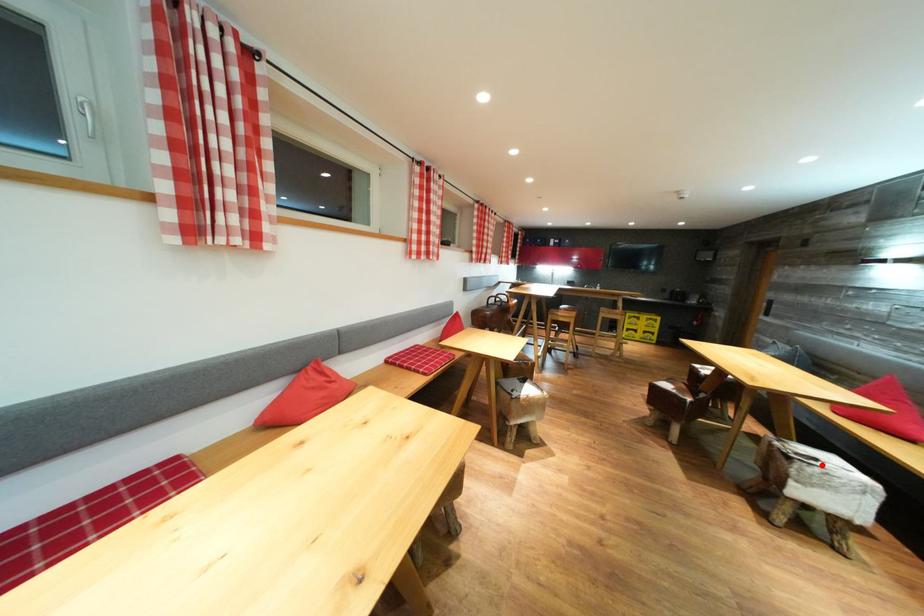
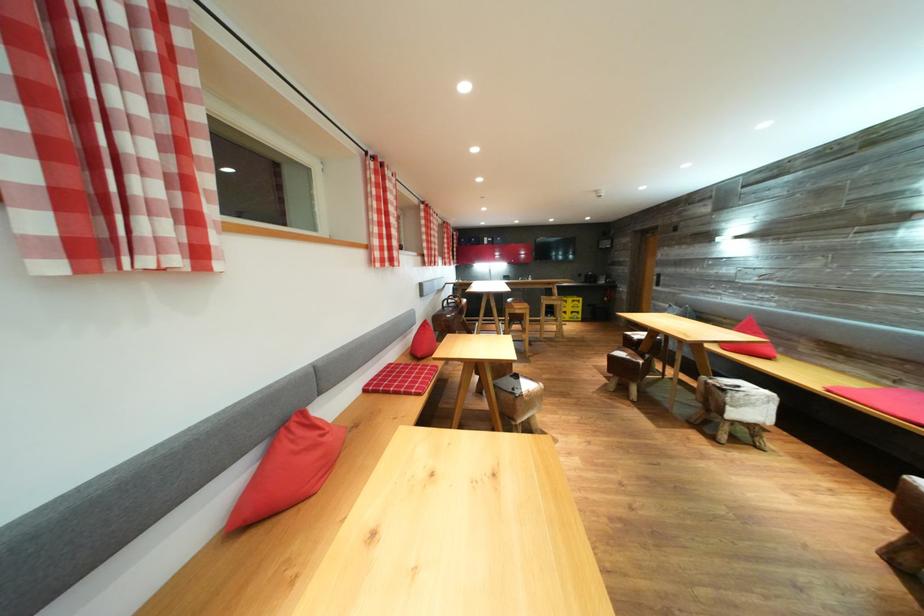
Where in the second image is the point corresponding to the highlighted location from the first image?

(745, 392)